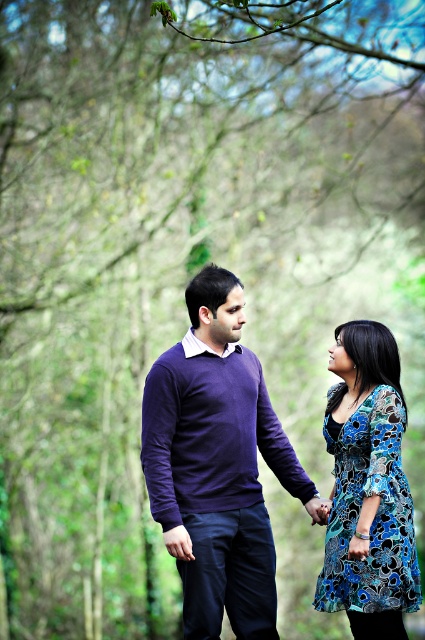
You are a photographer trying to capture a closeup shot of the purple sweater at center and the blue floral dress at center. Since you want to focus on both subjects equally, which one should you adjust your camera focus to prioritize to ensure both are in frame?

Since the purple sweater at center is larger in size than the blue floral dress at center, you should prioritize focusing on the purple sweater at center to ensure both are in frame.

From the picture: You are standing in the forest and want to take a photo of both the purple sweater at center and the blue floral dress at center. Which one should you focus on first to ensure both are in clear view?

You should focus on the purple sweater at center first since it is closer to you than the blue floral dress at center, ensuring both will be in clear view when focused properly.

You are a photographer trying to capture a portrait of the purple sweater at center and the blue floral dress at center. To ensure both subjects are in frame, from which side should you position yourself relative to the subjects?

You should position yourself to the right of the subjects because the purple sweater at center is to the left of the blue floral dress at center, so standing to the right would allow both to be framed together.